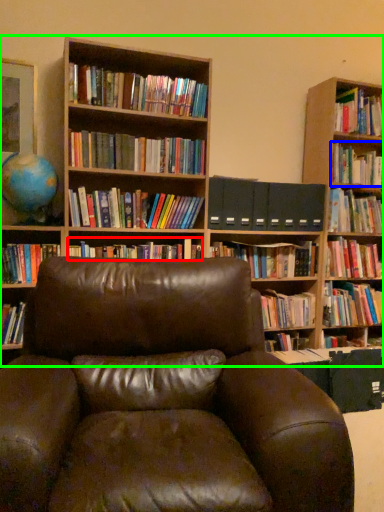
Question: Based on their relative distances, which object is nearer to book (highlighted by a red box)? Choose from book (highlighted by a blue box) and bookcase (highlighted by a green box).

Choices:
 (A) book
 (B) bookcase

Answer: (B)